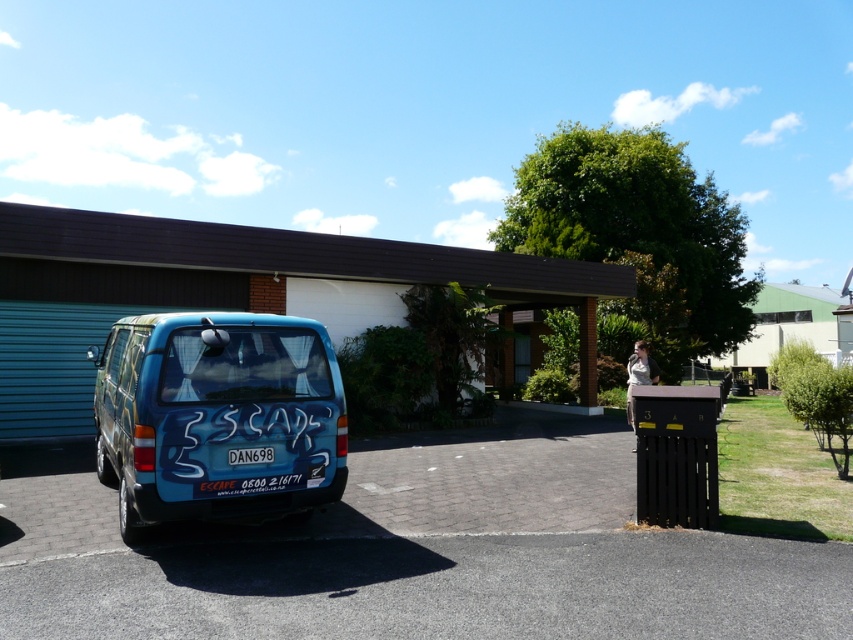
Question: Can you confirm if matte blue van at left is wider than white plastic license plate at center?

Choices:
 (A) yes
 (B) no

Answer: (A)

Question: Considering the real-world distances, which object is closest to the black asphalt at lower center?

Choices:
 (A) matte blue van at left
 (B) white plastic license plate at center

Answer: (B)

Question: Which of the following is the farthest from the observer?

Choices:
 (A) black asphalt at lower center
 (B) white plastic license plate at center

Answer: (B)

Question: Where is matte blue van at left located in relation to white plastic license plate at center in the image?

Choices:
 (A) right
 (B) left

Answer: (B)

Question: Among these objects, which one is farthest from the camera?

Choices:
 (A) matte blue van at left
 (B) black asphalt at lower center

Answer: (A)

Question: Is black asphalt at lower center below white plastic license plate at center?

Choices:
 (A) no
 (B) yes

Answer: (B)